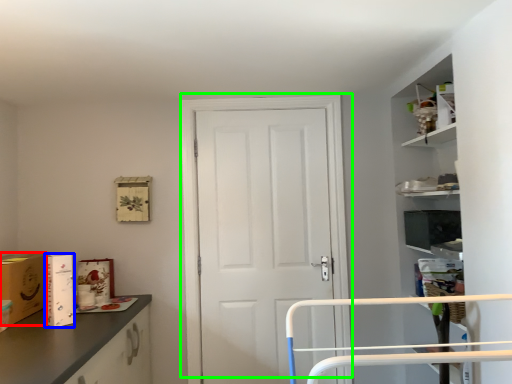
Question: Estimate the real-world distances between objects in this image. Which object is closer to cardboard box (highlighted by a red box), cardboard box (highlighted by a blue box) or door (highlighted by a green box)?

Choices:
 (A) cardboard box
 (B) door

Answer: (A)